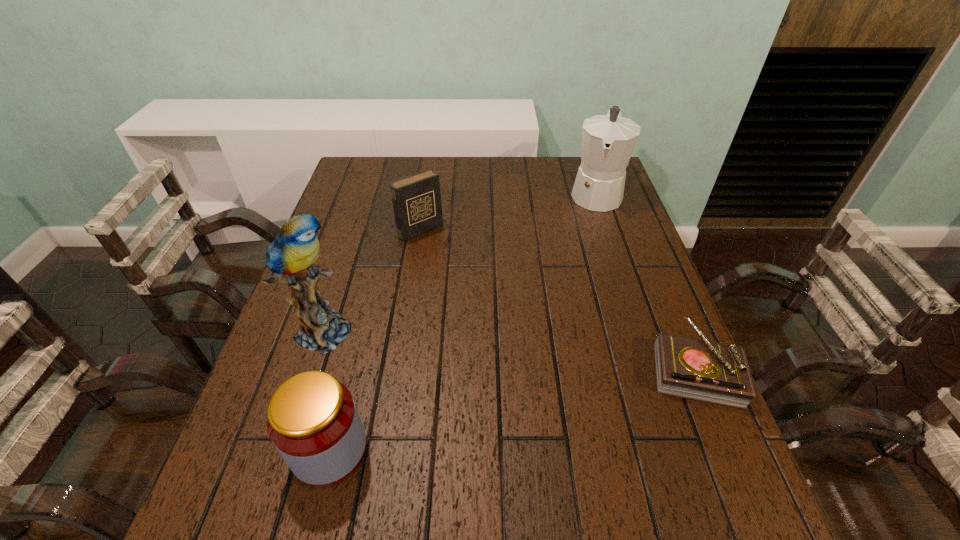
You are a GUI agent. You are given a task and a screenshot of the screen. Output one action in this format:
    pyautogui.click(x=<x>, y=<y>)
    Task: Click on the nearest object
    The width and height of the screenshot is (960, 540).
    Given the screenshot: What is the action you would take?
    pyautogui.click(x=313, y=421)

At what (x,y) coordinates should I click in order to perform the action: click on the shorter diary. Please return your answer as a coordinate pair (x, y). The height and width of the screenshot is (540, 960). Looking at the image, I should click on (701, 370).

Image resolution: width=960 pixels, height=540 pixels. Identify the location of the nearer diary. (701, 370).

Find the location of a particular element. Image resolution: width=960 pixels, height=540 pixels. parrot is located at coordinates (290, 257).

Identify the location of the fourth shortest object. Image resolution: width=960 pixels, height=540 pixels. (608, 141).

The image size is (960, 540). I want to click on coffeepot, so click(608, 141).

Find the location of a particular element. the fourth nearest object is located at coordinates (416, 199).

Where is `the left diary`? the left diary is located at coordinates (416, 199).

You are a GUI agent. You are given a task and a screenshot of the screen. Output one action in this format:
    pyautogui.click(x=<x>, y=<y>)
    Task: Click on the free space located on the right of the jar
    
    Given the screenshot: What is the action you would take?
    pyautogui.click(x=469, y=450)

I want to click on vacant space situated 0.350m on the left of the nearer diary, so click(487, 368).